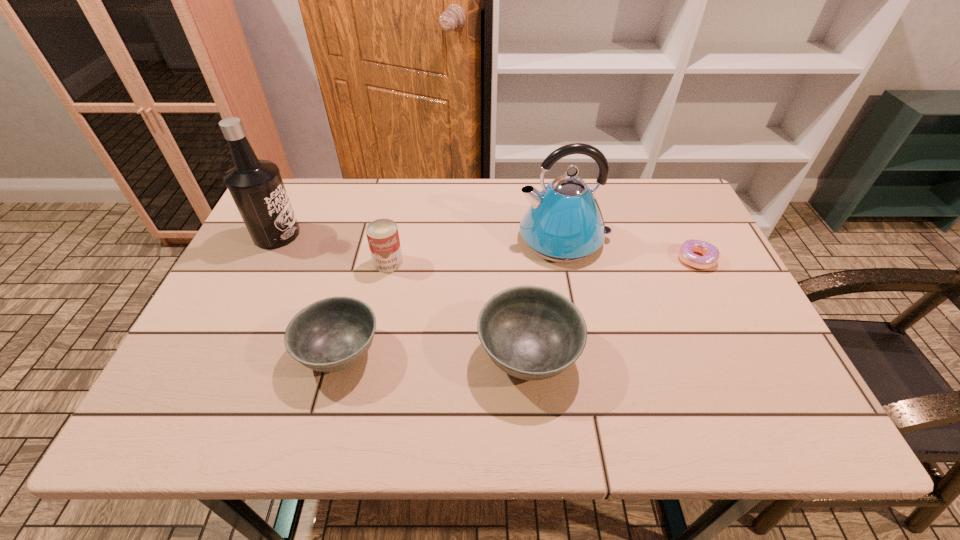
You are a GUI agent. You are given a task and a screenshot of the screen. Output one action in this format:
    pyautogui.click(x=<x>, y=<y>)
    Task: Click on the free spot that satisfies the following two spatial constraints: 1. at the spout of the fifth shortest object; 2. on the front side of the right bowl
    The image size is (960, 540).
    Given the screenshot: What is the action you would take?
    pyautogui.click(x=587, y=355)

The width and height of the screenshot is (960, 540). What are the coordinates of `vacant area in the image that satisfies the following two spatial constraints: 1. at the spout of the fifth shortest object; 2. on the left side of the rightmost object` in the screenshot? It's located at (567, 259).

Where is `free space that satisfies the following two spatial constraints: 1. at the spout of the second tallest object; 2. on the front label of the can`? This screenshot has height=540, width=960. free space that satisfies the following two spatial constraints: 1. at the spout of the second tallest object; 2. on the front label of the can is located at coordinates (568, 262).

You are a GUI agent. You are given a task and a screenshot of the screen. Output one action in this format:
    pyautogui.click(x=<x>, y=<y>)
    Task: Click on the vacant region that satisfies the following two spatial constraints: 1. at the spout of the kettle; 2. on the left side of the rightmost object
    This screenshot has width=960, height=540.
    Given the screenshot: What is the action you would take?
    pos(567,259)

This screenshot has height=540, width=960. Find the location of `free point that satisfies the following two spatial constraints: 1. on the front label of the shortest object; 2. on the right side of the liquor`. free point that satisfies the following two spatial constraints: 1. on the front label of the shortest object; 2. on the right side of the liquor is located at coordinates (264, 259).

Where is `vacant position in the image that satisfies the following two spatial constraints: 1. on the front side of the taller bowl; 2. on the left side of the shorter bowl`? vacant position in the image that satisfies the following two spatial constraints: 1. on the front side of the taller bowl; 2. on the left side of the shorter bowl is located at coordinates (339, 355).